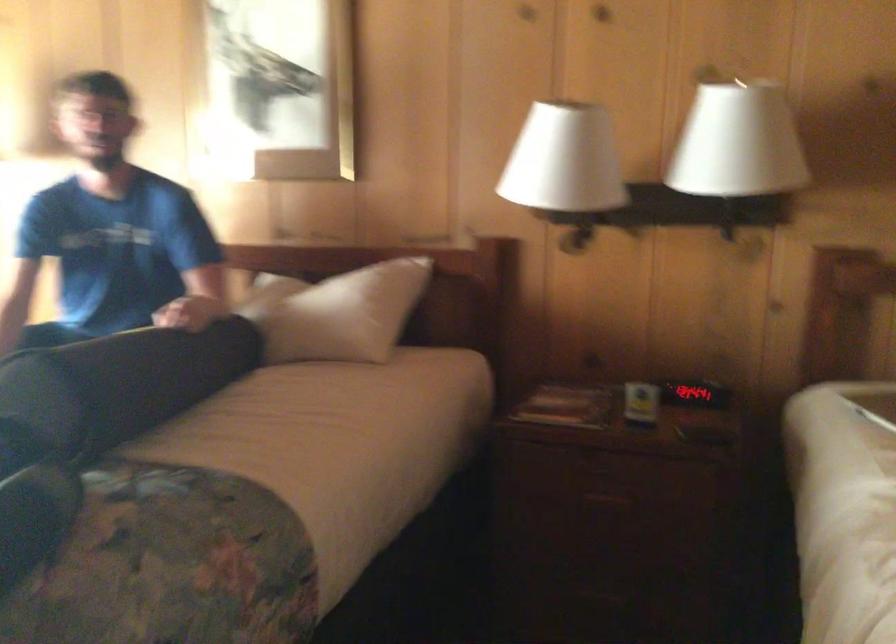
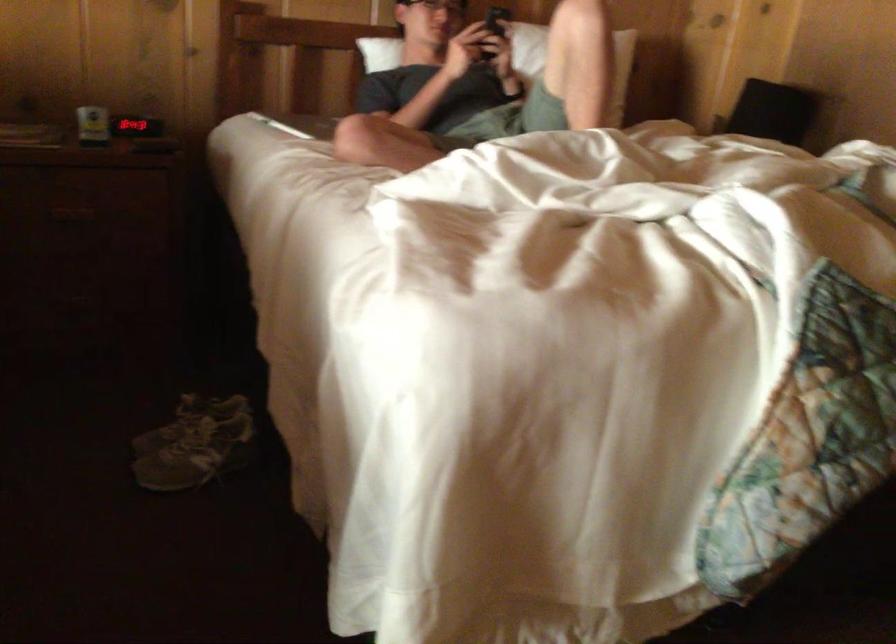
Find the pixel in the second image that matches point (698, 391) in the first image.

(135, 126)